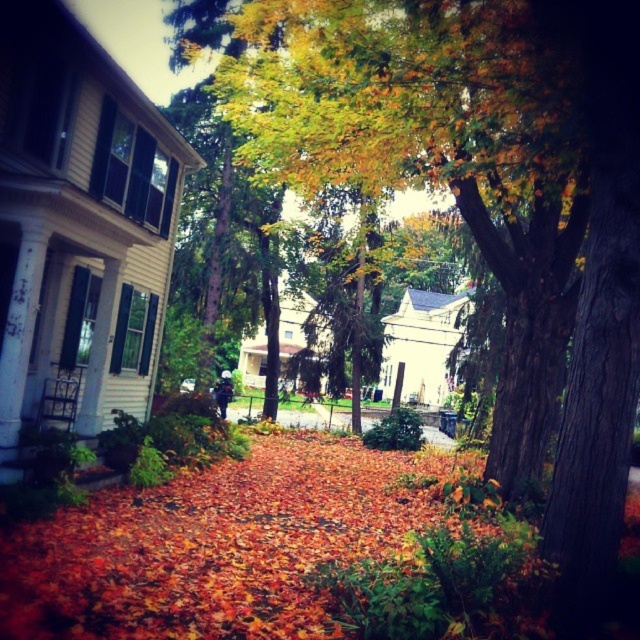
Question: Which of the following is the farthest from the observer?

Choices:
 (A) (310, 436)
 (B) (381, 177)

Answer: (A)

Question: Where is green leafy tree at center located in relation to autumn leaves at center in the image?

Choices:
 (A) above
 (B) below

Answer: (A)

Question: Which point is farther to the camera?

Choices:
 (A) (205, 496)
 (B) (406, 92)

Answer: (A)

Question: Can you confirm if green leafy tree at center is positioned below autumn leaves at center?

Choices:
 (A) yes
 (B) no

Answer: (B)

Question: Does green leafy tree at center have a smaller size compared to autumn leaves at center?

Choices:
 (A) no
 (B) yes

Answer: (A)

Question: Which object appears farthest from the camera in this image?

Choices:
 (A) green leafy tree at center
 (B) autumn leaves at center

Answer: (A)